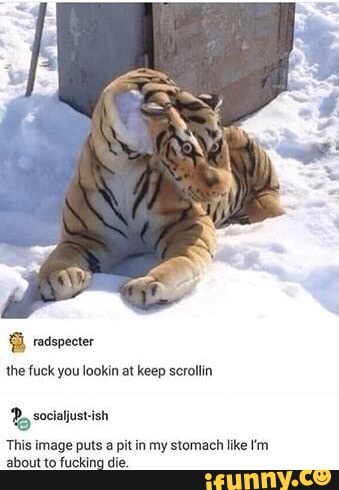
Image resolution: width=339 pixels, height=490 pixels. I want to click on chest, so click(x=127, y=211).